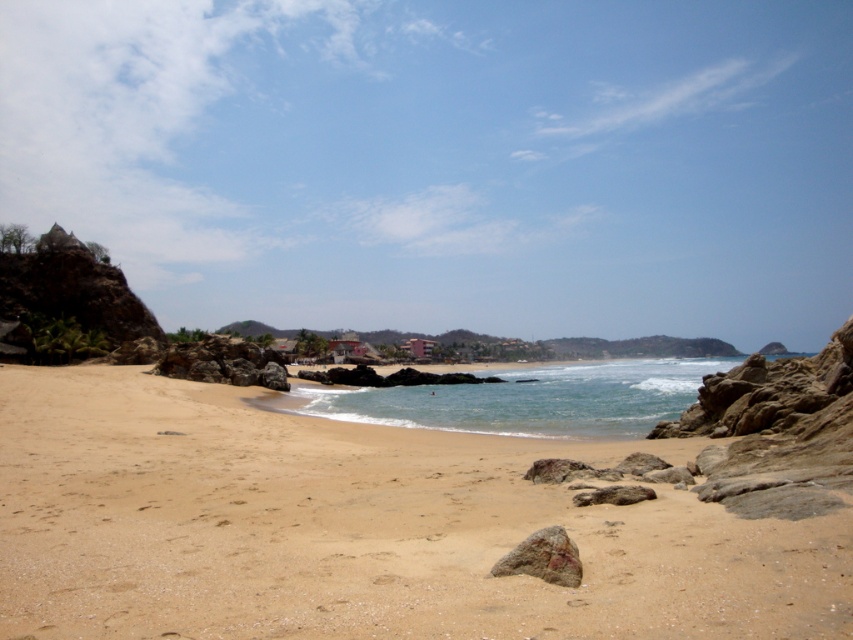
Question: In this image, where is sandy beach at lower left located relative to rusty rock at center?

Choices:
 (A) right
 (B) left

Answer: (B)

Question: Which object appears closest to the camera in this image?

Choices:
 (A) clear blue water at center
 (B) sandy beach at lower left

Answer: (B)

Question: Can you confirm if sandy beach at lower left is positioned below clear blue water at center?

Choices:
 (A) yes
 (B) no

Answer: (B)

Question: Which object is closer to the camera taking this photo?

Choices:
 (A) rusty rock at center
 (B) sandy beach at lower left

Answer: (B)

Question: Where is sandy beach at lower left located in relation to clear blue water at center in the image?

Choices:
 (A) below
 (B) above

Answer: (B)

Question: Among these points, which one is nearest to the camera?

Choices:
 (A) (714, 509)
 (B) (517, 561)

Answer: (B)